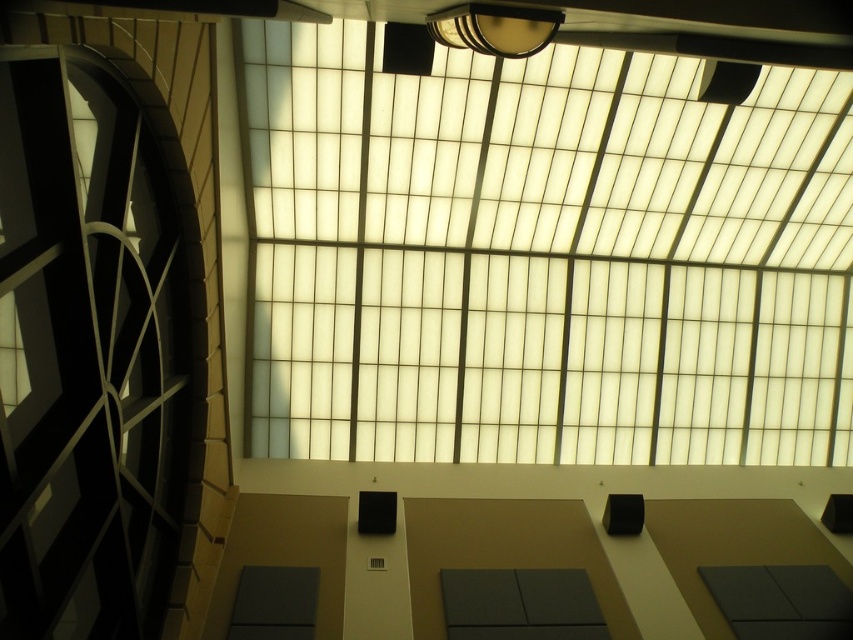
Question: Which point is closer to the camera taking this photo?

Choices:
 (A) (107, 186)
 (B) (444, 26)
 (C) (509, 61)

Answer: (B)

Question: Which object is farther from the camera taking this photo?

Choices:
 (A) matte black clock at left
 (B) metallic gold lamp at upper center
 (C) white frosted glass at upper center

Answer: (C)

Question: In this image, where is matte black clock at left located relative to metallic gold lamp at upper center?

Choices:
 (A) below
 (B) above

Answer: (A)

Question: Can you confirm if white frosted glass at upper center is positioned above matte black clock at left?

Choices:
 (A) yes
 (B) no

Answer: (A)

Question: Can you confirm if matte black clock at left is positioned to the right of metallic gold lamp at upper center?

Choices:
 (A) yes
 (B) no

Answer: (B)

Question: Which of these objects is positioned closest to the metallic gold lamp at upper center?

Choices:
 (A) matte black clock at left
 (B) white frosted glass at upper center

Answer: (A)